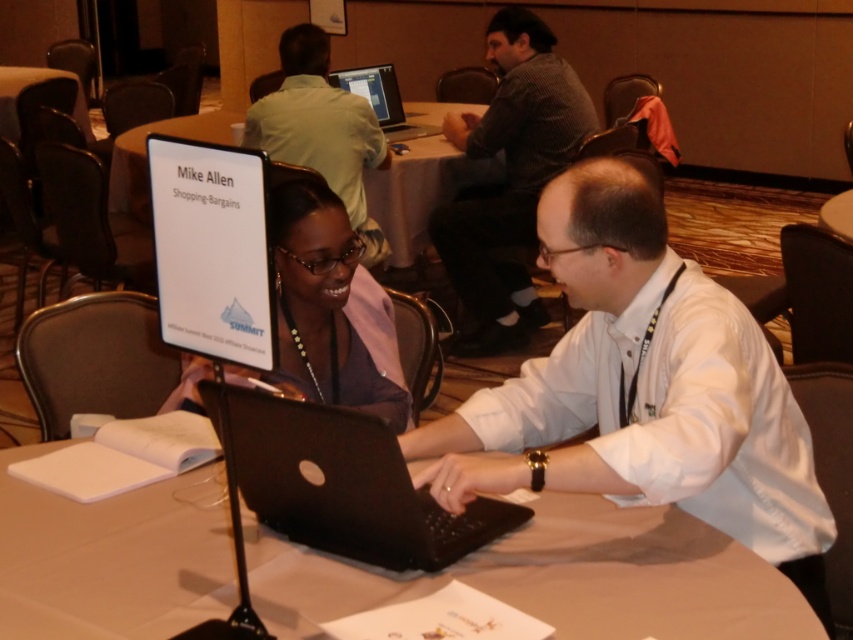
You are organizing a conference and need to ensure that all nameplates are visible to attendees. Given that the gray checkered shirt at upper center is positioned in front of the black plastic laptop at center, which object might be blocking the view of the nameplate holder? Explain your reasoning.

The gray checkered shirt at upper center is taller than the black plastic laptop at center. Since the gray checkered shirt is in front, it might be blocking the view of the nameplate holder located behind it.

You are a service robot in the conference room. You need to deliver a document to the person at point (149, 513). Your maximum reach is 1.5 meters. Can you reach them without moving?

The distance between you and the person at point (149, 513) is 1.67 meters, which exceeds your maximum reach of 1.5 meters. You will need to move closer to deliver the document.

Please provide the 2D coordinates of the matte purple shirt at center in the image. The coordinates should be in the format of a tuple with two decimal numbers, like this example format. Please do not add any other information besides the coordinates.

The 2D coordinates of the matte purple shirt at center are at point (x=329, y=307).